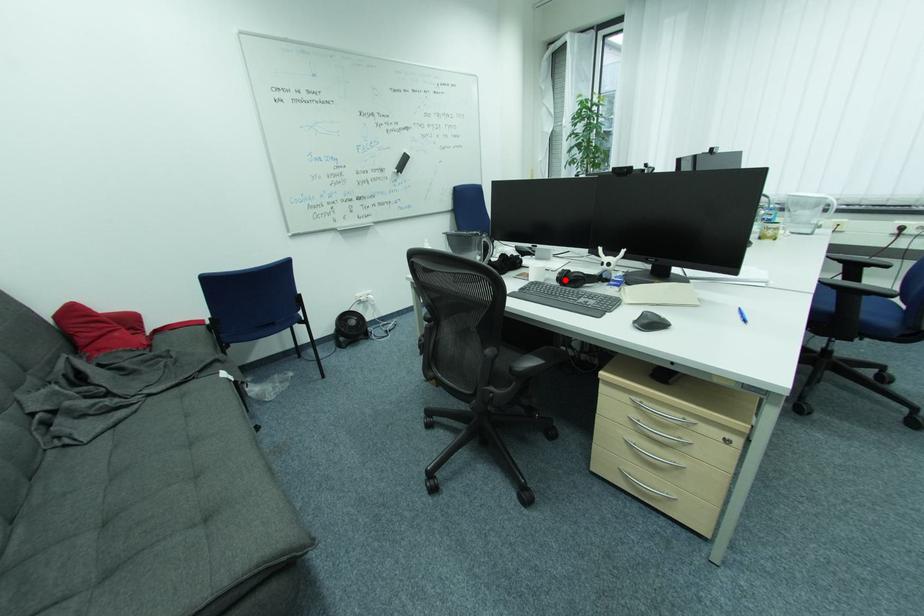
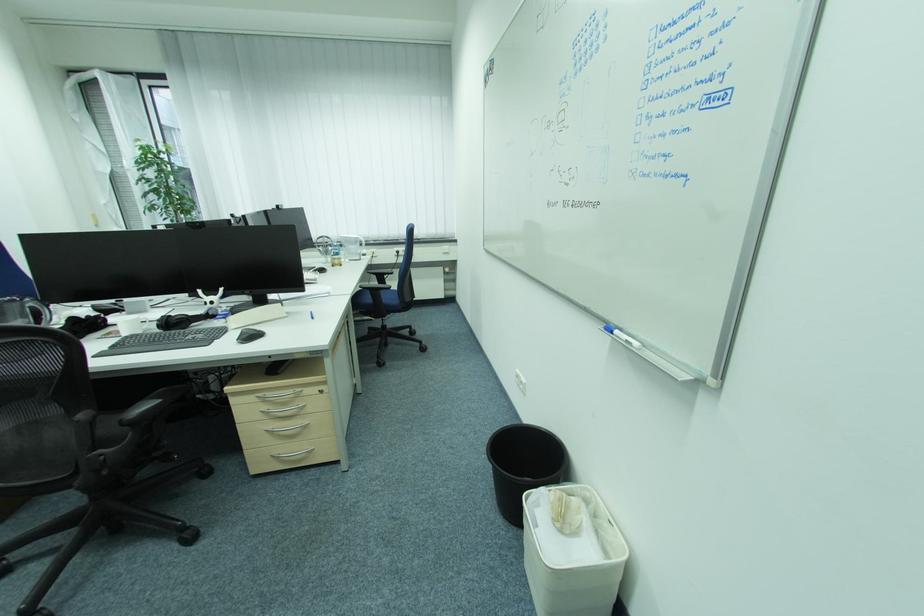
Question: I am providing you with two images of the same scene from different viewpoints. Image1 has a red point marked. In image2, the corresponding 3D location appears at what relative position? Reply with the corresponding letter.

Choices:
 (A) Closer
 (B) Farther

Answer: (B)